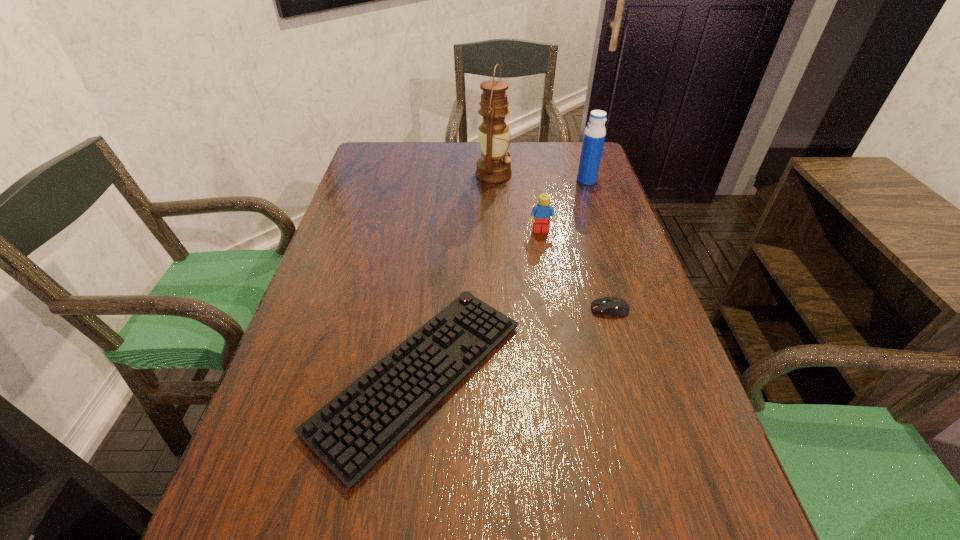
Where is `free space at the left edge of the desktop`? The image size is (960, 540). free space at the left edge of the desktop is located at coordinates (296, 398).

At what (x,y) coordinates should I click in order to perform the action: click on free region at the right edge. Please return your answer as a coordinate pair (x, y). This screenshot has width=960, height=540. Looking at the image, I should click on (658, 447).

This screenshot has width=960, height=540. Identify the location of free spot at the far left corner of the desktop. (377, 161).

Where is `vacant area at the far right corner`? The width and height of the screenshot is (960, 540). vacant area at the far right corner is located at coordinates (551, 157).

Locate an element on the screen. This screenshot has width=960, height=540. vacant space in between the computer equipment and the third tallest object is located at coordinates (575, 270).

The image size is (960, 540). I want to click on unoccupied area between the computer equipment and the third tallest object, so click(x=575, y=270).

Find the location of a particular element. The image size is (960, 540). unoccupied position between the tallest object and the computer equipment is located at coordinates (552, 242).

Where is `unoccupied position between the computer equipment and the fourth shortest object`? unoccupied position between the computer equipment and the fourth shortest object is located at coordinates (598, 245).

The image size is (960, 540). I want to click on unoccupied position between the third nearest object and the tallest object, so click(x=517, y=202).

Locate an element on the screen. Image resolution: width=960 pixels, height=540 pixels. free space between the tallest object and the computer keyboard is located at coordinates (456, 275).